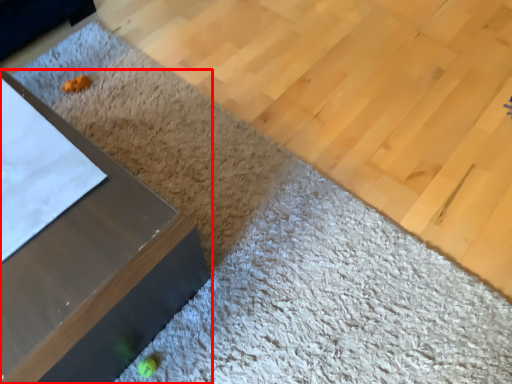
Question: Where is furniture (annotated by the red box) located in relation to plywood in the image?

Choices:
 (A) left
 (B) right

Answer: (A)